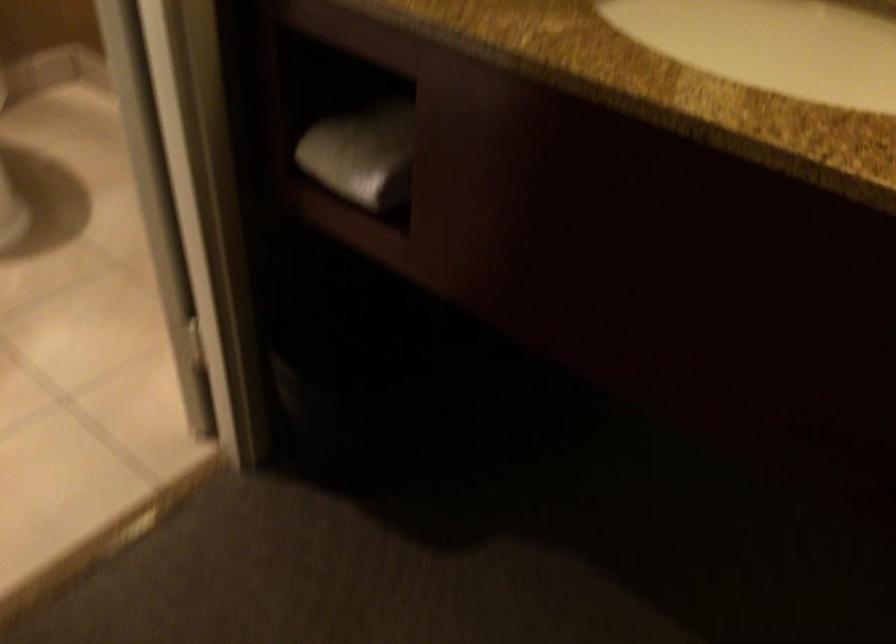
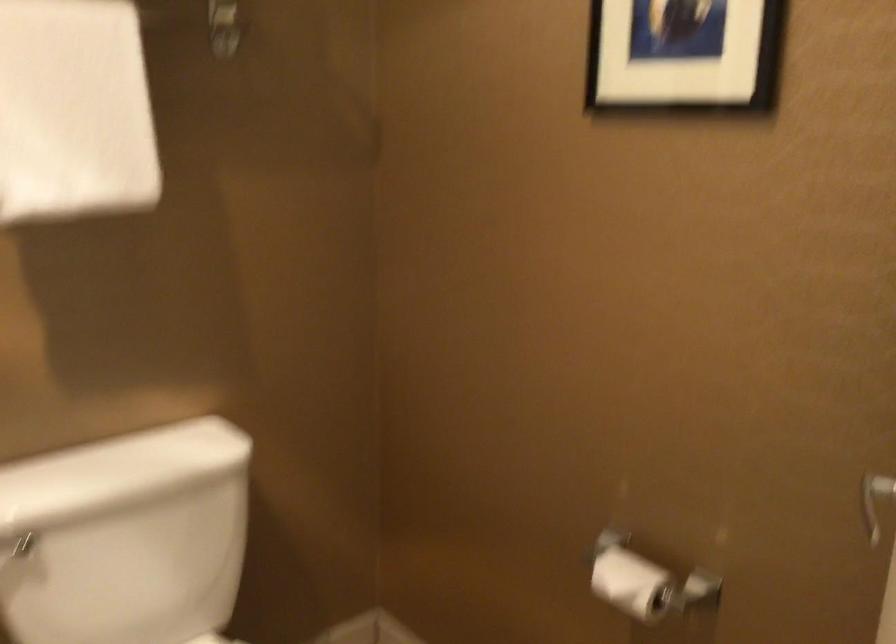
Question: Based on the continuous images, in which direction is the camera rotating? Reply with the corresponding letter.

Choices:
 (A) Left
 (B) Right
 (C) Up
 (D) Down

Answer: (C)